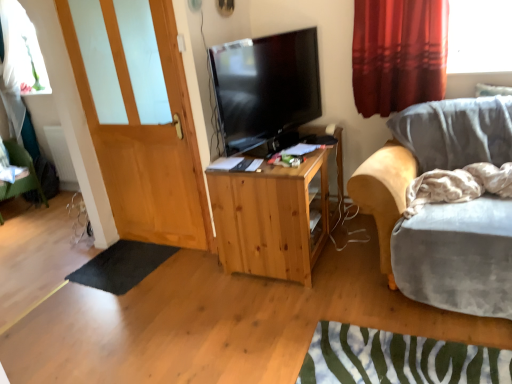
This screenshot has height=384, width=512. I want to click on vacant area situated to the left side of wooden door at left, so (118, 257).